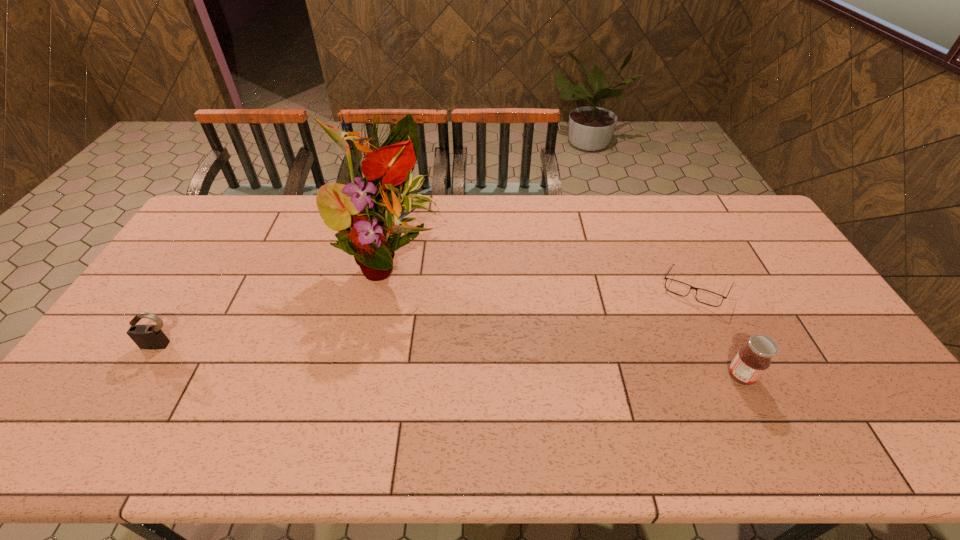
You are a GUI agent. You are given a task and a screenshot of the screen. Output one action in this format:
    pyautogui.click(x=<x>, y=<y>)
    Task: Click on the vacant space in between the bouquet and the spectacles
    The height and width of the screenshot is (540, 960).
    Given the screenshot: What is the action you would take?
    pyautogui.click(x=543, y=274)

Where is `the second closest object to the spectacles`? the second closest object to the spectacles is located at coordinates (367, 213).

The height and width of the screenshot is (540, 960). What are the coordinates of `object that stands as the third closest to the jam` in the screenshot? It's located at (151, 337).

You are a GUI agent. You are given a task and a screenshot of the screen. Output one action in this format:
    pyautogui.click(x=<x>, y=<y>)
    Task: Click on the free region that satisfies the following two spatial constraints: 1. with the keyhole on the front of the jam; 2. on the label side of the second nearest object
    This screenshot has width=960, height=540.
    Given the screenshot: What is the action you would take?
    pyautogui.click(x=142, y=376)

The width and height of the screenshot is (960, 540). What are the coordinates of `free location that satisfies the following two spatial constraints: 1. on the front side of the tallest object; 2. on the label side of the nearest object` in the screenshot? It's located at (367, 376).

Image resolution: width=960 pixels, height=540 pixels. Find the location of `vacant space that satisfies the following two spatial constraints: 1. with the keyhole on the front of the leftmost object; 2. on the label side of the nearest object`. vacant space that satisfies the following two spatial constraints: 1. with the keyhole on the front of the leftmost object; 2. on the label side of the nearest object is located at coordinates (142, 376).

Locate an element on the screen. free space in the image that satisfies the following two spatial constraints: 1. on the front side of the nearest object; 2. on the label side of the spectacles is located at coordinates (735, 376).

Find the location of a particular element. vacant point that satisfies the following two spatial constraints: 1. with the keyhole on the front of the leftmost object; 2. on the label side of the jam is located at coordinates (142, 376).